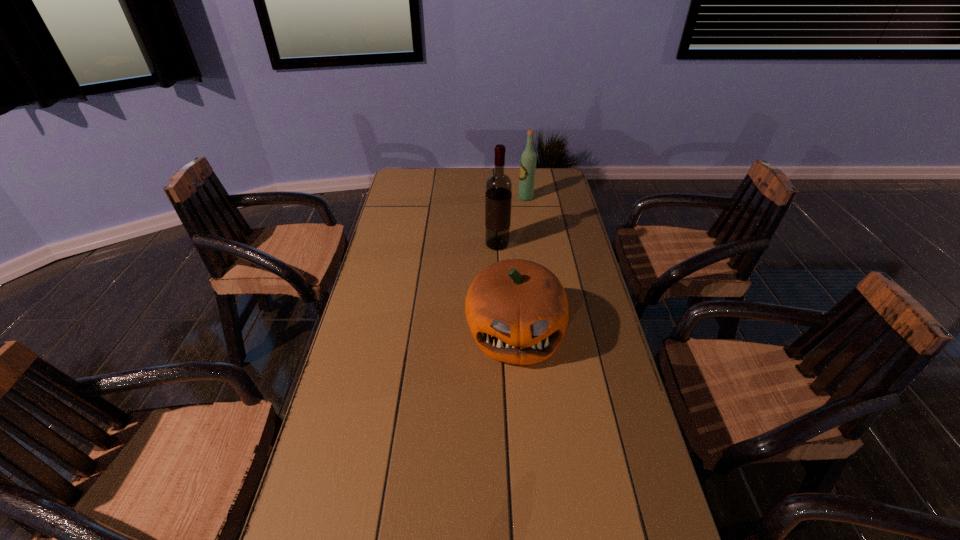
Find the location of a particular element. The height and width of the screenshot is (540, 960). free space between the second farthest object and the farthest object is located at coordinates (512, 221).

The height and width of the screenshot is (540, 960). I want to click on blank region between the tallest object and the right wine bottle, so click(x=512, y=221).

The height and width of the screenshot is (540, 960). I want to click on object that can be found as the closest to the nearer wine bottle, so click(517, 311).

You are a GUI agent. You are given a task and a screenshot of the screen. Output one action in this format:
    pyautogui.click(x=<x>, y=<y>)
    Task: Click on the object that stands as the second closest to the left wine bottle
    The width and height of the screenshot is (960, 540).
    Given the screenshot: What is the action you would take?
    pyautogui.click(x=528, y=160)

At what (x,y) coordinates should I click in order to perform the action: click on vacant space that satisfies the following two spatial constraints: 1. on the front-facing side of the second shortest object; 2. on the face of the pumpkin. Please return your answer as a coordinate pair (x, y). Image resolution: width=960 pixels, height=540 pixels. Looking at the image, I should click on (546, 333).

At what (x,y) coordinates should I click in order to perform the action: click on vacant region that satisfies the following two spatial constraints: 1. on the front-facing side of the farthest object; 2. on the face of the shortest object. Please return your answer as a coordinate pair (x, y). Looking at the image, I should click on (546, 333).